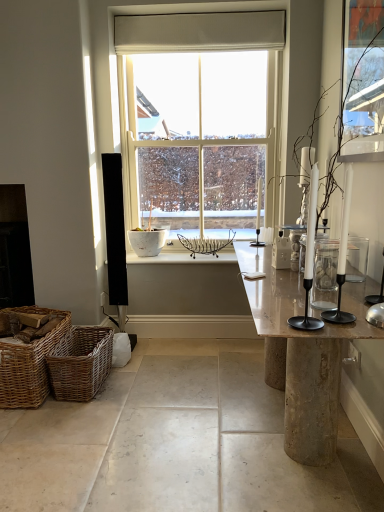
Where is `vacant space underneath marble table at center (from a real-world perspective)`? The height and width of the screenshot is (512, 384). vacant space underneath marble table at center (from a real-world perspective) is located at coordinates (278, 438).